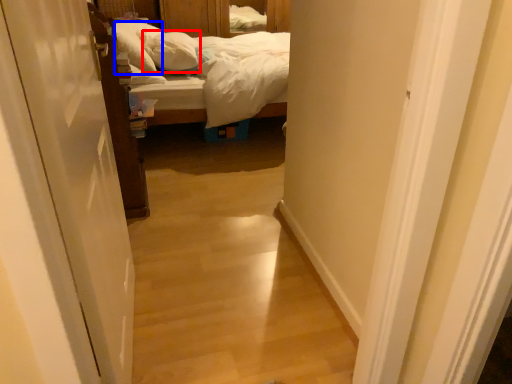
Question: Which of the following is the closest to the observer, pillow (highlighted by a red box) or pillow (highlighted by a blue box)?

Choices:
 (A) pillow
 (B) pillow

Answer: (B)